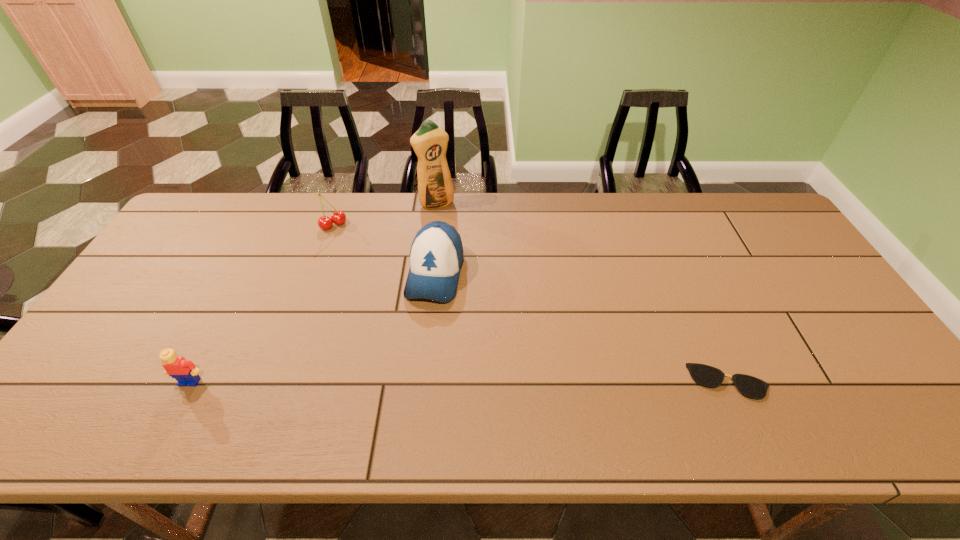
At what (x,y) coordinates should I click in order to perform the action: click on Lego present at the near edge. Please return your answer as a coordinate pair (x, y). Looking at the image, I should click on (184, 371).

The image size is (960, 540). In order to click on spectacles present at the near edge in this screenshot , I will do `click(705, 375)`.

In the image, there is a desktop. At what (x,y) coordinates should I click in order to perform the action: click on vacant space at the far edge. Please return your answer as a coordinate pair (x, y). The image size is (960, 540). Looking at the image, I should click on (254, 204).

This screenshot has height=540, width=960. I want to click on vacant area at the near edge of the desktop, so click(729, 395).

The image size is (960, 540). Identify the location of vacant space at the left edge of the desktop. (187, 293).

This screenshot has width=960, height=540. In the image, there is a desktop. In order to click on free space at the right edge in this screenshot , I will do `click(785, 316)`.

This screenshot has width=960, height=540. Find the location of `free region at the far left corner of the desktop`. free region at the far left corner of the desktop is located at coordinates (245, 200).

The width and height of the screenshot is (960, 540). Find the location of `free spot between the Lego and the cherry`. free spot between the Lego and the cherry is located at coordinates (262, 303).

Locate an element on the screen. The image size is (960, 540). vacant space that is in between the rightmost object and the detergent is located at coordinates (583, 293).

You are a GUI agent. You are given a task and a screenshot of the screen. Output one action in this format:
    pyautogui.click(x=<x>, y=<y>)
    Task: Click on the vacant space that is in between the shortest object and the detergent
    The width and height of the screenshot is (960, 540).
    Given the screenshot: What is the action you would take?
    pyautogui.click(x=583, y=293)